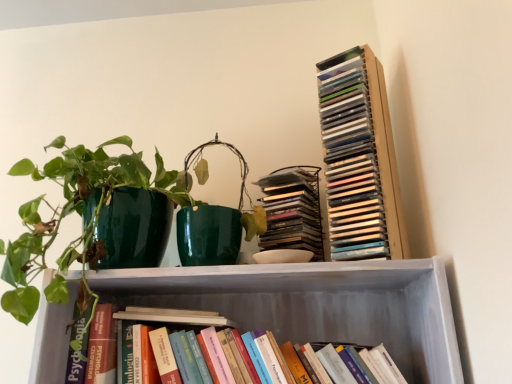
Question: Is matte plastic stack of cds at upper right, the second book positioned from the top, at the right side of clear plastic stack of cds at upper right, positioned as the 3th book in bottom-to-top order?

Choices:
 (A) yes
 (B) no

Answer: (B)

Question: Is matte plastic stack of cds at upper right, the second book positioned from the top, facing away from clear plastic stack of cds at upper right, acting as the first book starting from the top?

Choices:
 (A) no
 (B) yes

Answer: (A)

Question: From the image's perspective, is matte plastic stack of cds at upper right, the second book positioned from the top, beneath clear plastic stack of cds at upper right, acting as the first book starting from the top?

Choices:
 (A) yes
 (B) no

Answer: (A)

Question: Is clear plastic stack of cds at upper right, acting as the first book starting from the top, inside matte plastic stack of cds at upper right, marked as the 2th book in a bottom-to-top arrangement?

Choices:
 (A) yes
 (B) no

Answer: (B)

Question: Considering the relative positions of matte plastic stack of cds at upper right, marked as the 2th book in a bottom-to-top arrangement, and clear plastic stack of cds at upper right, acting as the first book starting from the top, in the image provided, is matte plastic stack of cds at upper right, marked as the 2th book in a bottom-to-top arrangement, in front of clear plastic stack of cds at upper right, acting as the first book starting from the top,?

Choices:
 (A) no
 (B) yes

Answer: (A)

Question: Considering their positions, is hardcover books at lower center, the 1th book positioned from the bottom, located in front of or behind green glossy pot at left?

Choices:
 (A) behind
 (B) front

Answer: (A)

Question: From the image's perspective, is hardcover books at lower center, the 1th book positioned from the bottom, located above or below green glossy pot at left?

Choices:
 (A) below
 (B) above

Answer: (A)

Question: Considering the positions of hardcover books at lower center, the 3th book when ordered from top to bottom, and green glossy pot at left in the image, is hardcover books at lower center, the 3th book when ordered from top to bottom, taller or shorter than green glossy pot at left?

Choices:
 (A) short
 (B) tall

Answer: (A)

Question: Is point (345, 349) positioned closer to the camera than point (98, 173)?

Choices:
 (A) closer
 (B) farther

Answer: (B)

Question: Considering the positions of green glossy pot at left and matte plastic stack of cds at upper right, the second book positioned from the top, in the image, is green glossy pot at left taller or shorter than matte plastic stack of cds at upper right, the second book positioned from the top,?

Choices:
 (A) tall
 (B) short

Answer: (A)

Question: Is green glossy pot at left in front of or behind matte plastic stack of cds at upper right, the second book positioned from the top, in the image?

Choices:
 (A) behind
 (B) front

Answer: (B)

Question: Is green glossy pot at left situated inside matte plastic stack of cds at upper right, the second book positioned from the top, or outside?

Choices:
 (A) outside
 (B) inside

Answer: (A)

Question: From the image's perspective, relative to matte plastic stack of cds at upper right, the second book positioned from the top, is green glossy pot at left above or below?

Choices:
 (A) above
 (B) below

Answer: (B)

Question: Considering their positions, is green glossy pot at left located in front of or behind hardcover books at lower center, the 1th book positioned from the bottom?

Choices:
 (A) behind
 (B) front

Answer: (B)

Question: Is green glossy pot at left wider or thinner than hardcover books at lower center, the 3th book when ordered from top to bottom?

Choices:
 (A) thin
 (B) wide

Answer: (B)